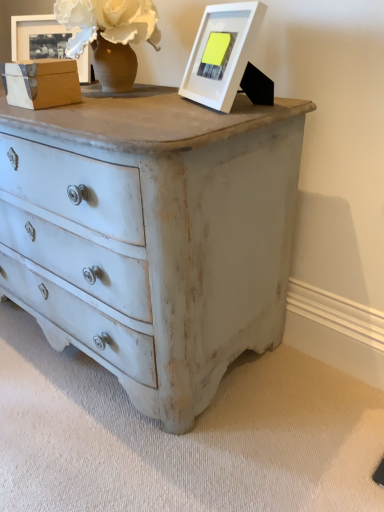
Question: Is white matte picture frame at upper center, arranged as the second picture frame when viewed from the left, thinner than matte wooden picture frame at upper left, marked as the 1th picture frame in a back-to-front arrangement?

Choices:
 (A) yes
 (B) no

Answer: (B)

Question: Considering the relative positions of white matte picture frame at upper center, which is the first picture frame in right-to-left order, and matte wooden picture frame at upper left, acting as the 1th picture frame starting from the top, in the image provided, is white matte picture frame at upper center, which is the first picture frame in right-to-left order, to the right of matte wooden picture frame at upper left, acting as the 1th picture frame starting from the top, from the viewer's perspective?

Choices:
 (A) no
 (B) yes

Answer: (B)

Question: Is white matte picture frame at upper center, which is the first picture frame in bottom-to-top order, oriented towards matte wooden picture frame at upper left, which is the second picture frame from bottom to top?

Choices:
 (A) no
 (B) yes

Answer: (A)

Question: Does white matte picture frame at upper center, placed as the first picture frame when sorted from front to back, have a greater width compared to matte wooden picture frame at upper left, which is counted as the 2th picture frame, starting from the right?

Choices:
 (A) no
 (B) yes

Answer: (B)

Question: Is white matte picture frame at upper center, placed as the first picture frame when sorted from front to back, taller than matte wooden picture frame at upper left, the first picture frame positioned from the left?

Choices:
 (A) no
 (B) yes

Answer: (B)

Question: Is white matte picture frame at upper center, arranged as the second picture frame when viewed from the left, positioned with its back to matte wooden picture frame at upper left, marked as the 1th picture frame in a back-to-front arrangement?

Choices:
 (A) yes
 (B) no

Answer: (B)

Question: Is white matte picture frame at upper center, placed as the first picture frame when sorted from front to back, completely or partially inside matte wooden picture frame at upper left, the first picture frame positioned from the left?

Choices:
 (A) no
 (B) yes

Answer: (A)

Question: From a real-world perspective, is matte wooden picture frame at upper left, acting as the 1th picture frame starting from the top, physically above white matte picture frame at upper center, which is the first picture frame in right-to-left order?

Choices:
 (A) yes
 (B) no

Answer: (A)

Question: Can you confirm if matte wooden picture frame at upper left, the first picture frame positioned from the left, is positioned to the right of white matte picture frame at upper center, marked as the 2th picture frame in a back-to-front arrangement?

Choices:
 (A) yes
 (B) no

Answer: (B)

Question: From the image's perspective, is matte wooden picture frame at upper left, the 2th picture frame in the front-to-back sequence, under white matte picture frame at upper center, which is the first picture frame in bottom-to-top order?

Choices:
 (A) yes
 (B) no

Answer: (B)

Question: Considering the relative sizes of matte wooden picture frame at upper left, marked as the 1th picture frame in a back-to-front arrangement, and white matte picture frame at upper center, positioned as the 2th picture frame in top-to-bottom order, in the image provided, is matte wooden picture frame at upper left, marked as the 1th picture frame in a back-to-front arrangement, wider than white matte picture frame at upper center, positioned as the 2th picture frame in top-to-bottom order,?

Choices:
 (A) yes
 (B) no

Answer: (B)

Question: Considering the relative positions of matte wooden picture frame at upper left, marked as the 1th picture frame in a back-to-front arrangement, and white matte picture frame at upper center, which is the first picture frame in bottom-to-top order, in the image provided, is matte wooden picture frame at upper left, marked as the 1th picture frame in a back-to-front arrangement, to the left of white matte picture frame at upper center, which is the first picture frame in bottom-to-top order, from the viewer's perspective?

Choices:
 (A) yes
 (B) no

Answer: (A)

Question: Does point (246, 14) appear closer or farther from the camera than point (29, 48)?

Choices:
 (A) closer
 (B) farther

Answer: (A)